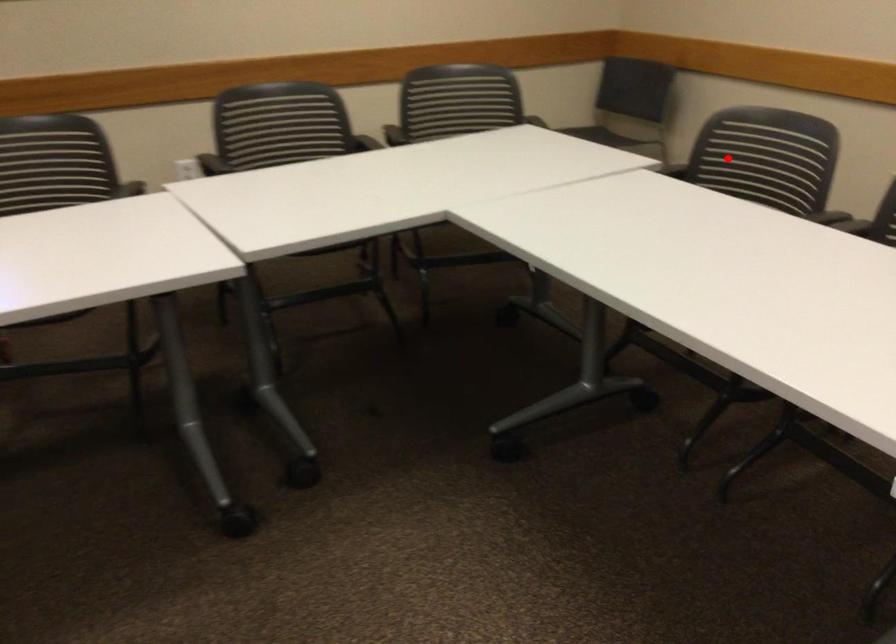
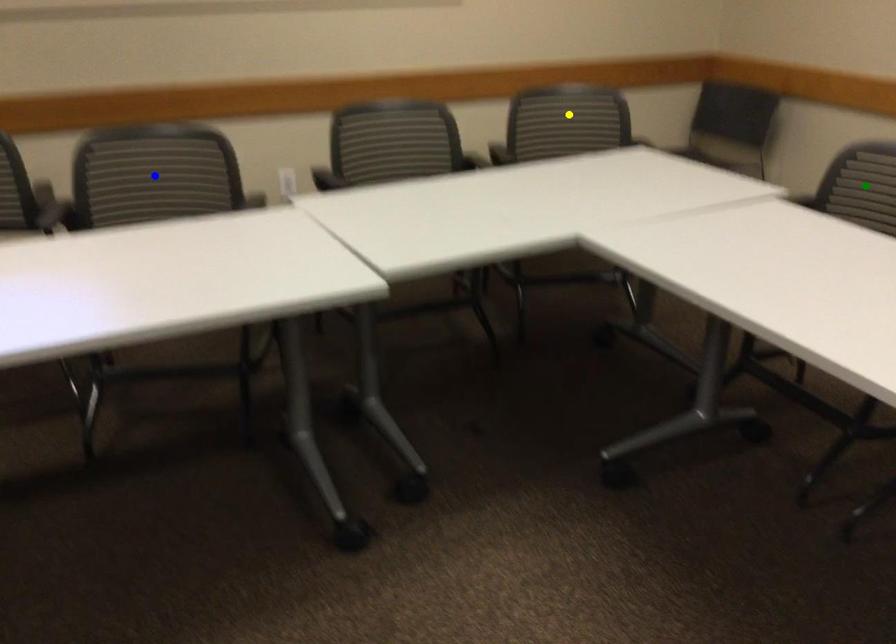
Question: I am providing you with two images of the same scene from different viewpoints. A red point is marked on the first image. You are given multiple points on the second image. Which spot in image 2 lines up with the point in image 1?

Choices:
 (A) green point
 (B) blue point
 (C) yellow point

Answer: (A)